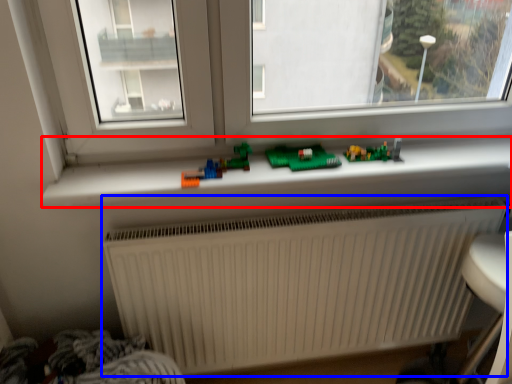
Question: Which object is closer to the camera taking this photo, window sill (highlighted by a red box) or radiator (highlighted by a blue box)?

Choices:
 (A) window sill
 (B) radiator

Answer: (A)